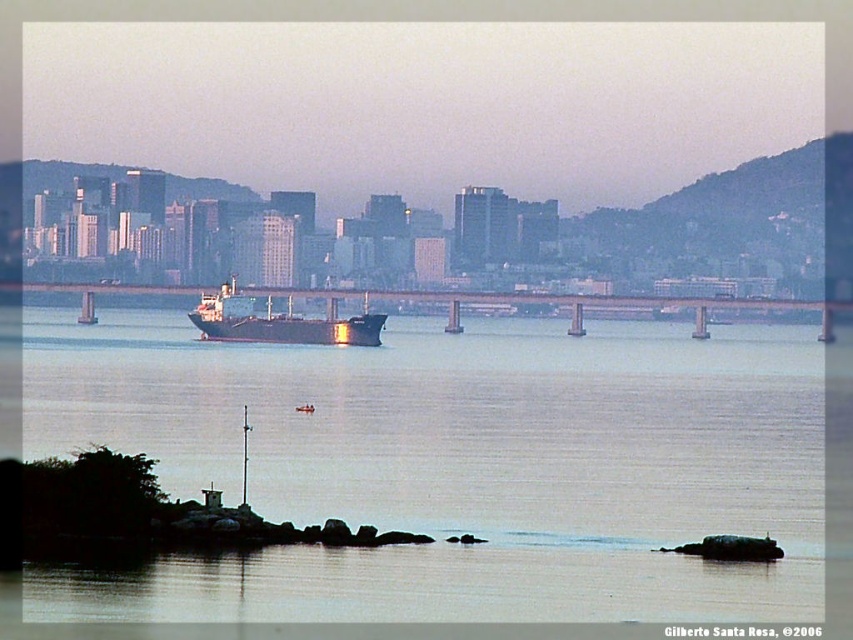
Does smooth water at center have a lesser height compared to metal bridge at center?

In fact, smooth water at center may be taller than metal bridge at center.

Who is higher up, smooth water at center or metal bridge at center?

metal bridge at center is above.

Where is `smooth water at center`? The width and height of the screenshot is (853, 640). smooth water at center is located at coordinates (451, 467).

Can you confirm if metal bridge at center is bigger than shiny black ship at center?

Yes.

Is point (425, 292) positioned after point (357, 321)?

Yes.

Where is `metal bridge at center`? Image resolution: width=853 pixels, height=640 pixels. metal bridge at center is located at coordinates (567, 304).

Is smooth water at center to the left of shiny black ship at center from the viewer's perspective?

In fact, smooth water at center is to the right of shiny black ship at center.

Is smooth water at center taller than shiny black ship at center?

Correct, smooth water at center is much taller as shiny black ship at center.

What do you see at coordinates (451, 467) in the screenshot?
I see `smooth water at center` at bounding box center [451, 467].

At what (x,y) coordinates should I click in order to perform the action: click on smooth water at center. Please return your answer as a coordinate pair (x, y). Looking at the image, I should click on (451, 467).